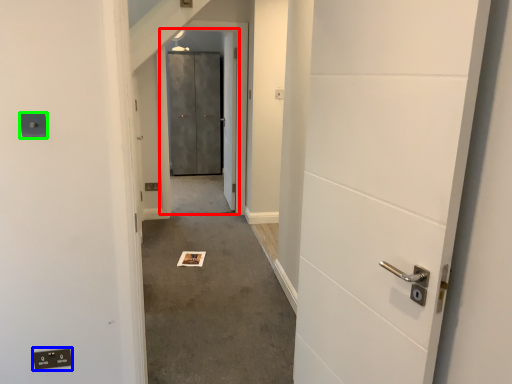
Question: Estimate the real-world distances between objects in this image. Which object is closer to elevator door (highlighted by a red box), electric outlet (highlighted by a blue box) or electric outlet (highlighted by a green box)?

Choices:
 (A) electric outlet
 (B) electric outlet

Answer: (B)